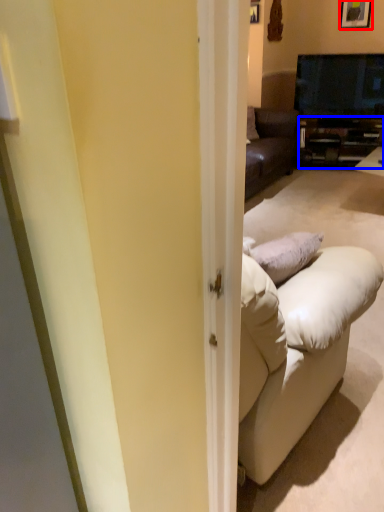
Question: Which of the following is the farthest to the observer, picture frame (highlighted by a red box) or cabinetry (highlighted by a blue box)?

Choices:
 (A) picture frame
 (B) cabinetry

Answer: (B)